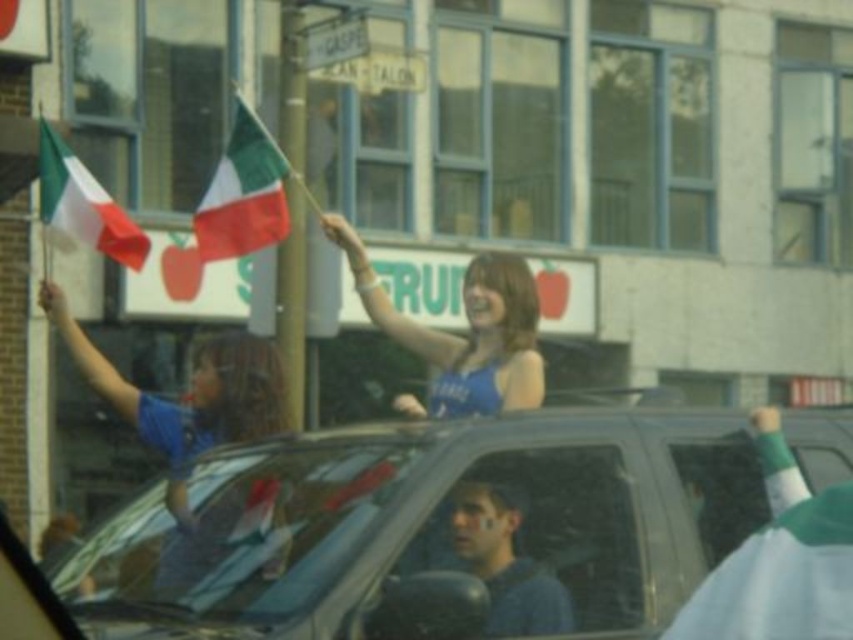
You are a photographer trying to capture the metallic silver car at center in the middle of the frame. Based on its current position at point coordinates, is it already centered in the image?

The metallic silver car at center is located at coordinates point [428,531], which means it is slightly shifted to the right from the exact center. Therefore, it is not perfectly centered in the image.

You are a photographer standing on the sidewalk. You want to take a photo of the metallic silver car at center and the smooth blue shirt at center. Which object should you focus on first if you want to capture both in the same frame without moving your camera?

The metallic silver car at center is located above the smooth blue shirt at center, so you should focus on the metallic silver car at center first to ensure both are in the frame.

You are a photographer trying to capture a photo of the matte blue shirt at upper left and the matte fabric flag at left. Based on their sizes in the image, which object would appear larger in your photo?

The matte blue shirt at upper left might be wider than matte fabric flag at left, so it would likely appear larger in the photo.